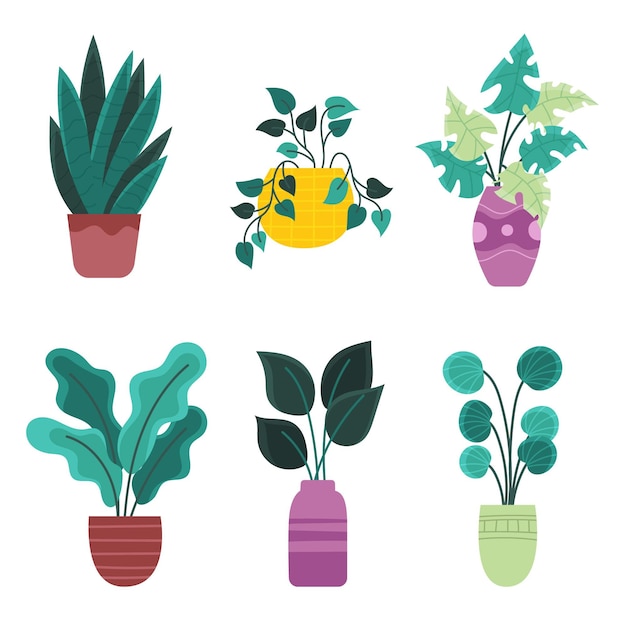
Where is `yellow vase`? This screenshot has height=626, width=626. yellow vase is located at coordinates (305, 220), (326, 218), (305, 198), (319, 203).